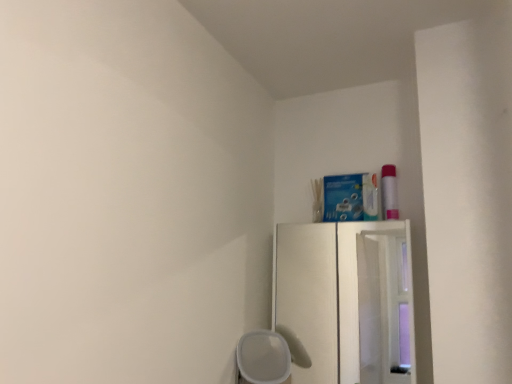
Question: From the image's perspective, is white matte cup at lower center located beneath white wood cabinet at upper right?

Choices:
 (A) yes
 (B) no

Answer: (A)

Question: From the image's perspective, is white matte cup at lower center above white wood cabinet at upper right?

Choices:
 (A) no
 (B) yes

Answer: (A)

Question: Is white matte cup at lower center placed right next to white wood cabinet at upper right?

Choices:
 (A) yes
 (B) no

Answer: (B)

Question: Could you tell me if white matte cup at lower center is facing white wood cabinet at upper right?

Choices:
 (A) no
 (B) yes

Answer: (A)

Question: Can you confirm if white matte cup at lower center is thinner than white wood cabinet at upper right?

Choices:
 (A) no
 (B) yes

Answer: (A)

Question: Is white matte cup at lower center shorter than white wood cabinet at upper right?

Choices:
 (A) no
 (B) yes

Answer: (B)

Question: Does white wood cabinet at upper right have a greater height compared to white matte cup at lower center?

Choices:
 (A) yes
 (B) no

Answer: (A)

Question: Does white wood cabinet at upper right have a larger size compared to white matte cup at lower center?

Choices:
 (A) yes
 (B) no

Answer: (B)

Question: Is white wood cabinet at upper right thinner than white matte cup at lower center?

Choices:
 (A) no
 (B) yes

Answer: (B)

Question: Is white wood cabinet at upper right facing towards white matte cup at lower center?

Choices:
 (A) no
 (B) yes

Answer: (B)

Question: Is white wood cabinet at upper right positioned with its back to white matte cup at lower center?

Choices:
 (A) yes
 (B) no

Answer: (B)

Question: Can you confirm if white wood cabinet at upper right is positioned to the right of white matte cup at lower center?

Choices:
 (A) yes
 (B) no

Answer: (A)

Question: From the image's perspective, is white matte cup at lower center located above or below white wood cabinet at upper right?

Choices:
 (A) above
 (B) below

Answer: (B)